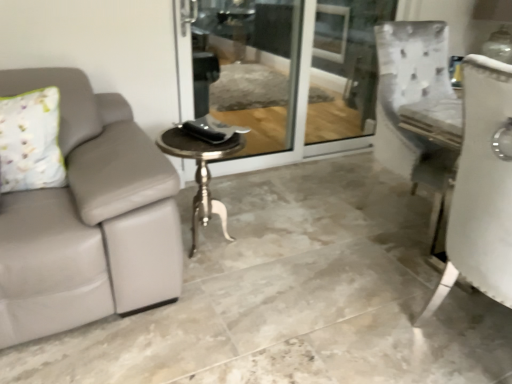
In order to click on vacant space that is in between polished silver table at center and clear glass screen door at center in this screenshot , I will do `click(285, 193)`.